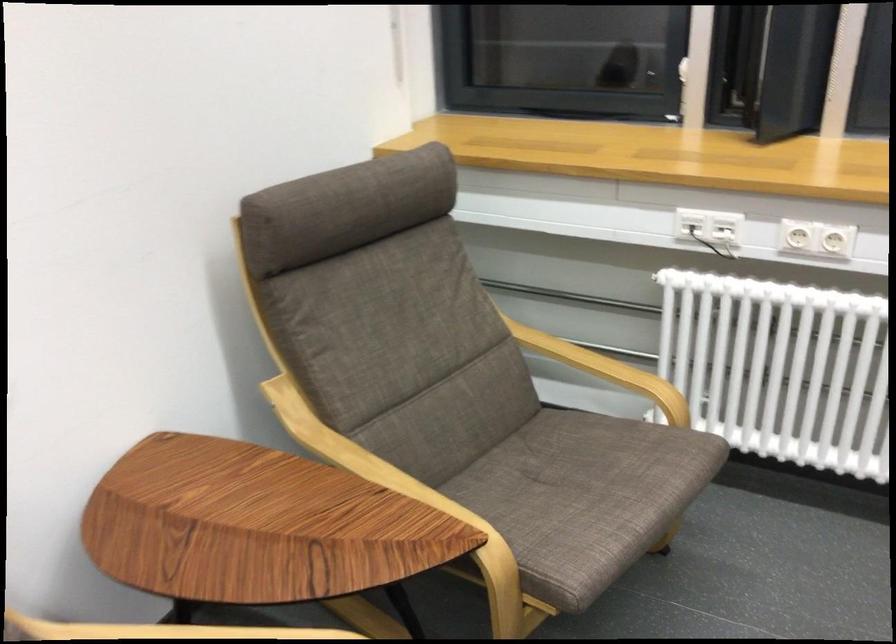
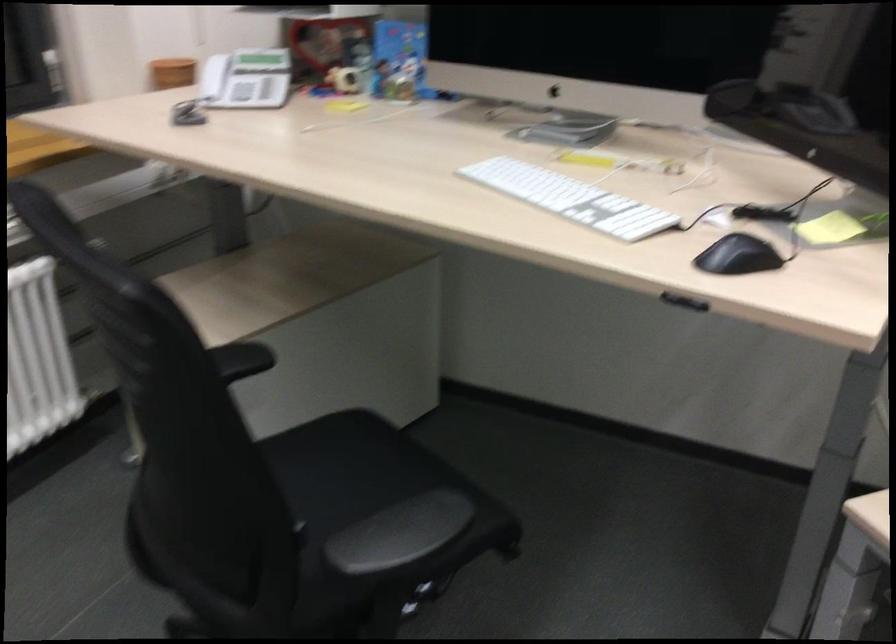
The first image is from the beginning of the video and the second image is from the end. How did the camera likely rotate when shooting the video?

The camera's rotation is toward right-down.